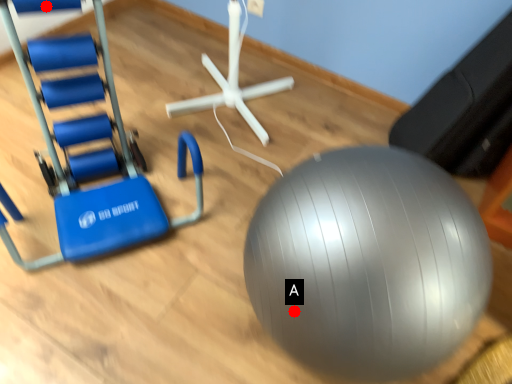
Question: Two points are circled on the image, labeled by A and B beside each circle. Among these points, which one is nearest to the camera?

Choices:
 (A) A is closer
 (B) B is closer

Answer: (A)